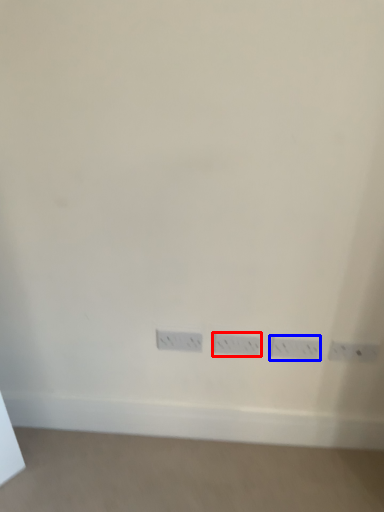
Question: Which of the following is the closest to the observer, power plugs and sockets (highlighted by a red box) or power plugs and sockets (highlighted by a blue box)?

Choices:
 (A) power plugs and sockets
 (B) power plugs and sockets

Answer: (B)